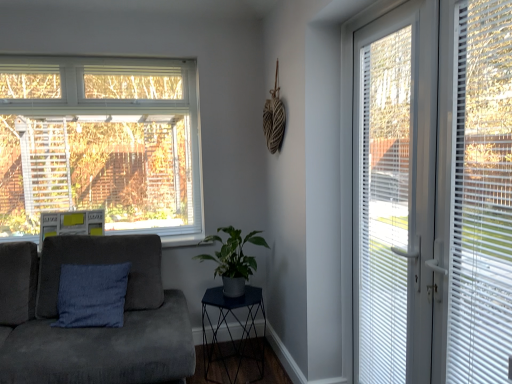
Question: From their relative heights in the image, would you say suede couch at left is taller or shorter than white plastic blinds at right?

Choices:
 (A) short
 (B) tall

Answer: (A)

Question: From the image's perspective, relative to white plastic blinds at right, is suede couch at left above or below?

Choices:
 (A) above
 (B) below

Answer: (B)

Question: Based on their relative distances, which object is farther from the blue fabric cushion at left?

Choices:
 (A) green matte plant at center
 (B) metallic dark blue side table at center
 (C) white plastic blinds at right
 (D) white plastic blinds at right
 (E) suede couch at left

Answer: (D)

Question: Based on their relative distances, which object is nearer to the blue fabric cushion at left?

Choices:
 (A) suede couch at left
 (B) white plastic blinds at right
 (C) white plastic blinds at right
 (D) white plastic door at right
 (E) metallic dark blue side table at center

Answer: (A)